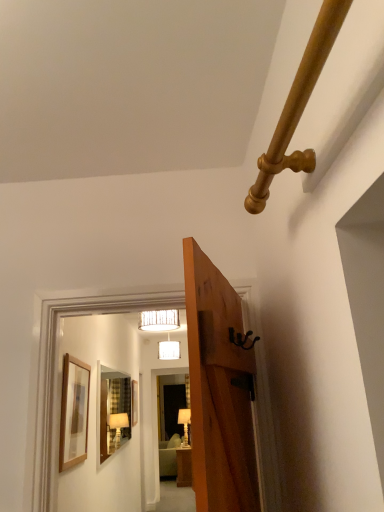
Question: Considering the relative positions of black matte door handle at upper right and gold polished pipe at upper right in the image provided, is black matte door handle at upper right to the left of gold polished pipe at upper right from the viewer's perspective?

Choices:
 (A) yes
 (B) no

Answer: (A)

Question: Can you confirm if black matte door handle at upper right is thinner than gold polished pipe at upper right?

Choices:
 (A) yes
 (B) no

Answer: (A)

Question: Does black matte door handle at upper right lie in front of gold polished pipe at upper right?

Choices:
 (A) yes
 (B) no

Answer: (B)

Question: Are black matte door handle at upper right and gold polished pipe at upper right making contact?

Choices:
 (A) no
 (B) yes

Answer: (A)

Question: From a real-world perspective, is black matte door handle at upper right physically above gold polished pipe at upper right?

Choices:
 (A) no
 (B) yes

Answer: (A)

Question: Could you tell me if black matte door handle at upper right is turned towards gold polished pipe at upper right?

Choices:
 (A) no
 (B) yes

Answer: (A)

Question: From the image's perspective, is matte white lampshade at upper center, which is counted as the third lamp, starting from the bottom, over white glossy lamp at center, which appears as the third lamp when viewed from the front?

Choices:
 (A) no
 (B) yes

Answer: (B)

Question: Is matte white lampshade at upper center, which is counted as the third lamp, starting from the bottom, positioned before white glossy lamp at center, which ranks as the third lamp in top-to-bottom order?

Choices:
 (A) no
 (B) yes

Answer: (B)

Question: Is matte white lampshade at upper center, marked as the 1th lamp in a front-to-back arrangement, with white glossy lamp at center, which ranks as the third lamp in top-to-bottom order?

Choices:
 (A) yes
 (B) no

Answer: (B)

Question: Does matte white lampshade at upper center, which is counted as the third lamp, starting from the bottom, have a greater width compared to white glossy lamp at center, which appears as the third lamp when viewed from the front?

Choices:
 (A) no
 (B) yes

Answer: (B)

Question: Is matte white lampshade at upper center, which appears as the first lamp when viewed from the top, not near white glossy lamp at center, arranged as the 1th lamp when ordered from the bottom?

Choices:
 (A) no
 (B) yes

Answer: (B)

Question: Does matte white lampshade at upper center, marked as the 1th lamp in a front-to-back arrangement, have a larger size compared to white glossy lamp at center, which ranks as the first lamp in back-to-front order?

Choices:
 (A) yes
 (B) no

Answer: (B)

Question: From a real-world perspective, is matte white lampshade at upper center, which appears as the first lamp when viewed from the top, positioned under white fabric lampshade at upper center, the 2th lamp in the bottom-to-top sequence, based on gravity?

Choices:
 (A) yes
 (B) no

Answer: (A)